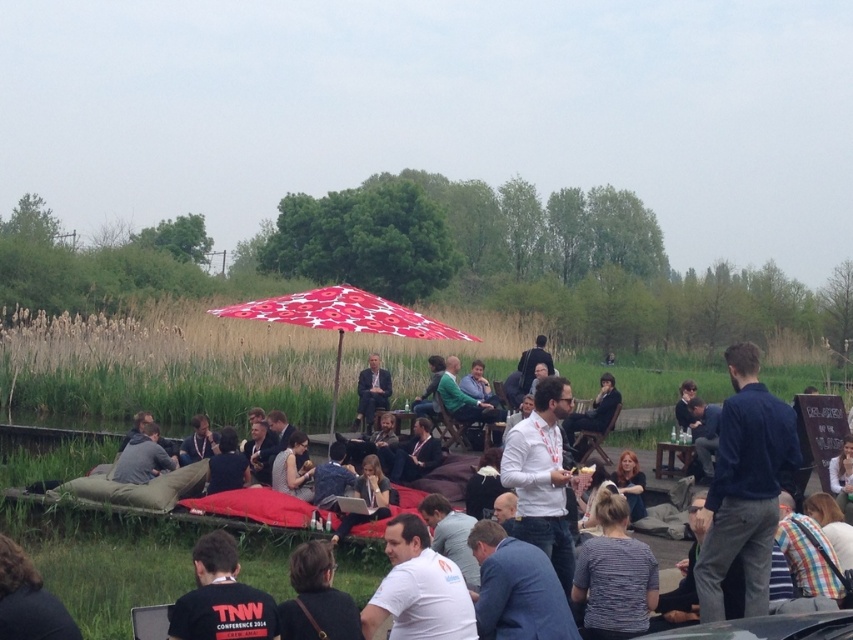
You are standing at the edge of the floating platform covered with red cushions and looking towards the point marked at coordinates (744, 486). What object is located at that point?

The point at coordinates (744, 486) is located on the dark blue shirt at center.

You are organizing a photo shoot and need to ensure that the dark blue shirt at center and the matte black suit at center are both visible in the frame. Given their sizes, which one might require more space to accommodate its width?

The dark blue shirt at center has a larger width than the matte black suit at center, so it would require more space to accommodate its width.

You are standing at the edge of the floating platform and want to walk to the point marked as point (364, 397). However, there is an obstacle at point (729, 436). Which point is closer to you, the obstacle or your destination?

Point (729, 436) is closer to you than point (364, 397), so the obstacle is closer.